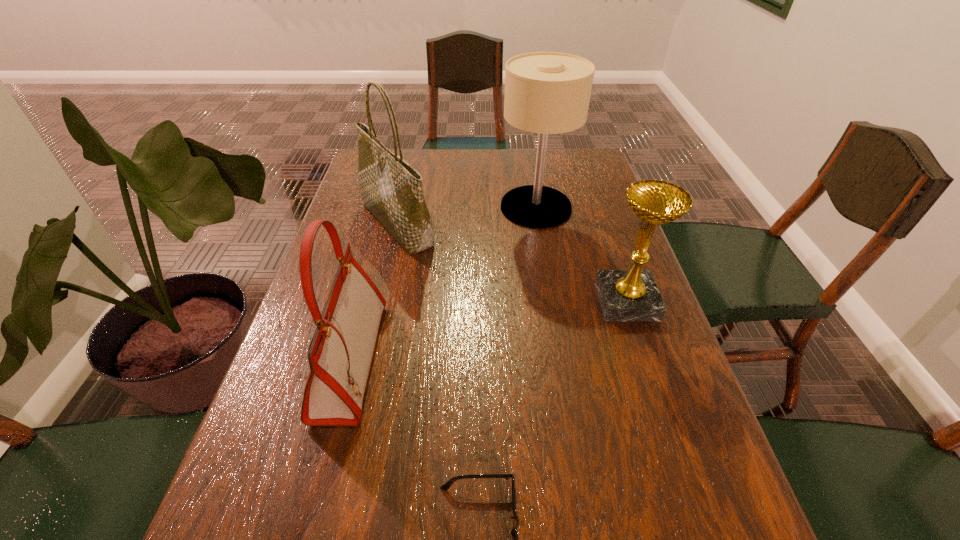
Where is `free region located on the front-facing side of the rightmost object`? free region located on the front-facing side of the rightmost object is located at coordinates (449, 301).

Where is `shopping bag present at the left edge`? shopping bag present at the left edge is located at coordinates (391, 189).

Locate an element on the screen. The height and width of the screenshot is (540, 960). handbag that is positioned at the left edge is located at coordinates (340, 353).

Find the location of `table lamp located in the right edge section of the desktop`. table lamp located in the right edge section of the desktop is located at coordinates (545, 92).

Find the location of a particular element. award present at the right edge is located at coordinates (625, 295).

You are a GUI agent. You are given a task and a screenshot of the screen. Output one action in this format:
    pyautogui.click(x=<x>, y=<y>)
    Task: Click on the vacant space at the far edge of the desktop
    The image size is (960, 540).
    Given the screenshot: What is the action you would take?
    pos(478,173)

The image size is (960, 540). I want to click on free space at the left edge of the desktop, so click(x=328, y=478).

Find the location of a particular element. This screenshot has width=960, height=540. free space at the right edge of the desktop is located at coordinates (603, 198).

At what (x,y) coordinates should I click in order to perform the action: click on blank space at the far right corner of the desktop. Please return your answer as a coordinate pair (x, y). Looking at the image, I should click on (579, 178).

The image size is (960, 540). In order to click on free point between the handbag and the fourth object from left to right in this screenshot , I will do `click(444, 284)`.